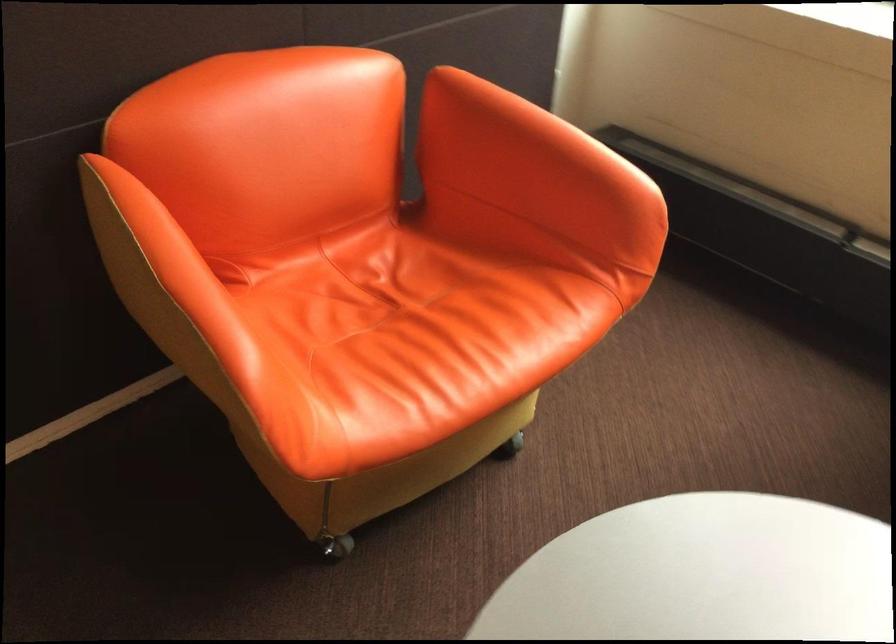
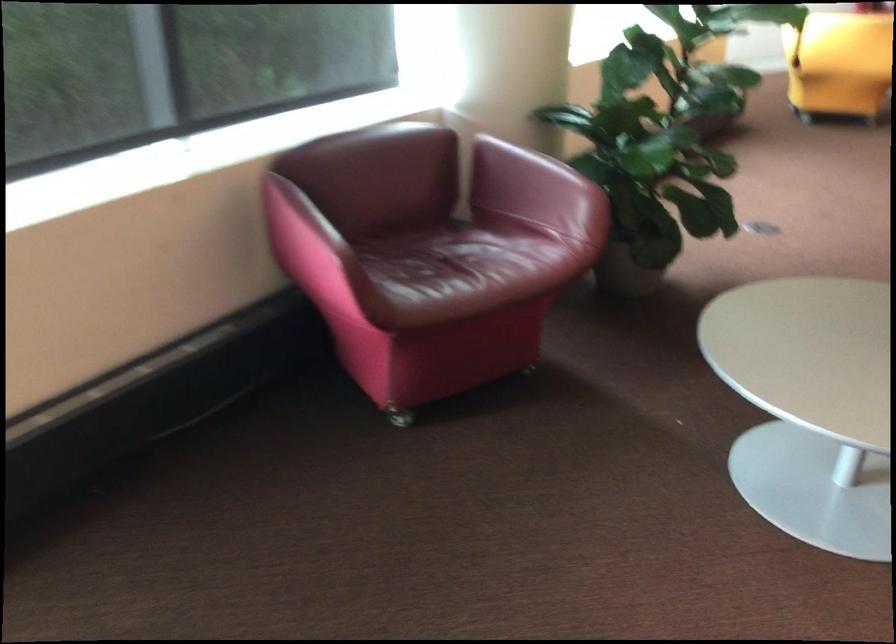
Based on the continuous images, in which direction is the camera rotating?

The camera's rotation is toward right-down.